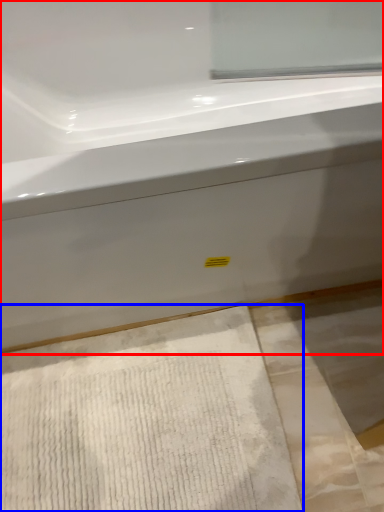
Question: Which point is further to the camera, bathtub (highlighted by a red box) or bath mat (highlighted by a blue box)?

Choices:
 (A) bathtub
 (B) bath mat

Answer: (B)